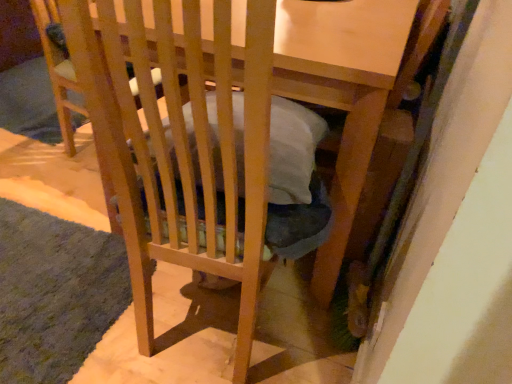
Question: Does point (53, 354) appear closer or farther from the camera than point (60, 71)?

Choices:
 (A) farther
 (B) closer

Answer: (B)

Question: In terms of height, does green shaggy rug at lower left look taller or shorter compared to wooden folding chair at center?

Choices:
 (A) tall
 (B) short

Answer: (B)

Question: Relative to wooden folding chair at center, is green shaggy rug at lower left in front or behind?

Choices:
 (A) behind
 (B) front

Answer: (B)

Question: From the image's perspective, is wooden folding chair at center above or below green shaggy rug at lower left?

Choices:
 (A) above
 (B) below

Answer: (A)

Question: From a real-world perspective, is wooden folding chair at center above or below green shaggy rug at lower left?

Choices:
 (A) above
 (B) below

Answer: (A)

Question: Is point (52, 39) positioned closer to the camera than point (117, 299)?

Choices:
 (A) closer
 (B) farther

Answer: (B)

Question: Is wooden folding chair at center spatially inside green shaggy rug at lower left, or outside of it?

Choices:
 (A) inside
 (B) outside

Answer: (B)